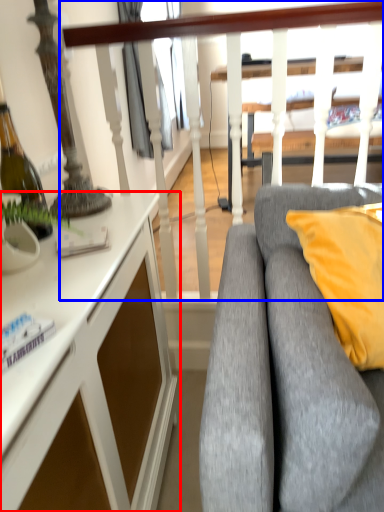
Question: Which object appears farthest to the camera in this image, desk (highlighted by a red box) or rail (highlighted by a blue box)?

Choices:
 (A) desk
 (B) rail

Answer: (B)